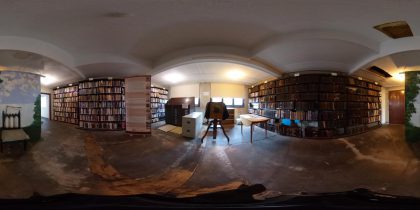
At what (x,y) coordinates should I click in order to perform the action: click on ceiling. Please return your answer as a coordinate pair (x, y). Looking at the image, I should click on (203, 24).